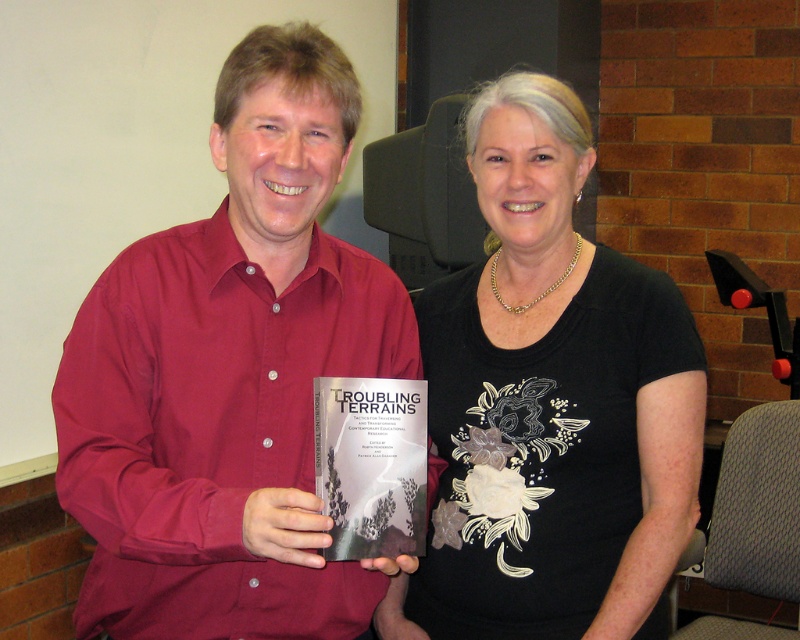
You are a photographer setting up for a group photo. You have two subjects wearing a matte red shirt at center and holding a matte gray book at center. To ensure both are clearly visible in the frame, which subject should you position closer to the camera?

The matte gray book at center is shorter than the matte red shirt at center, so positioning the matte gray book at center closer to the camera will help ensure both are clearly visible.

You are standing in the room where the two people are. You need to reach a point that is exactly 1.31 meters away from where you are currently standing. Can you confirm if the point at coordinates point (540, 241) is exactly that distance away?

The distance of point (540, 241) from camera is 1.31 meters, so yes, the point at coordinates point 0.377, 0.375 is exactly 1.31 meters away from your current position.